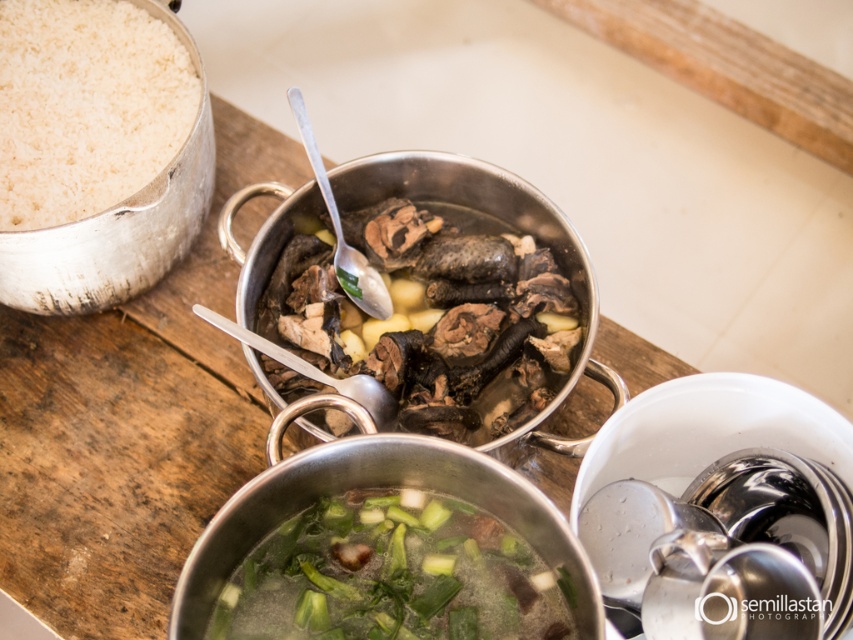
Question: Observing the image, what is the correct spatial positioning of brown matte meat at center in reference to green leafy vegetables at center?

Choices:
 (A) below
 (B) above

Answer: (B)

Question: Does brown matte meat at center appear over green leafy vegetables at center?

Choices:
 (A) no
 (B) yes

Answer: (B)

Question: Which point is farther from the camera taking this photo?

Choices:
 (A) (488, 544)
 (B) (450, 305)

Answer: (B)

Question: Is brown matte meat at center wider than green leafy vegetables at center?

Choices:
 (A) yes
 (B) no

Answer: (A)